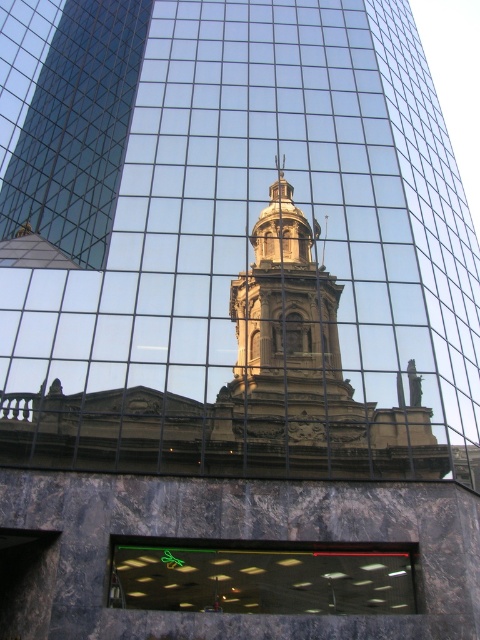
Does translucent glass window at center appear on the left side of golden stone bell tower at center?

Yes, translucent glass window at center is to the left of golden stone bell tower at center.

Is point (385, 552) less distant than point (298, 330)?

Yes, it is.

Find the location of a particular element. translucent glass window at center is located at coordinates (262, 580).